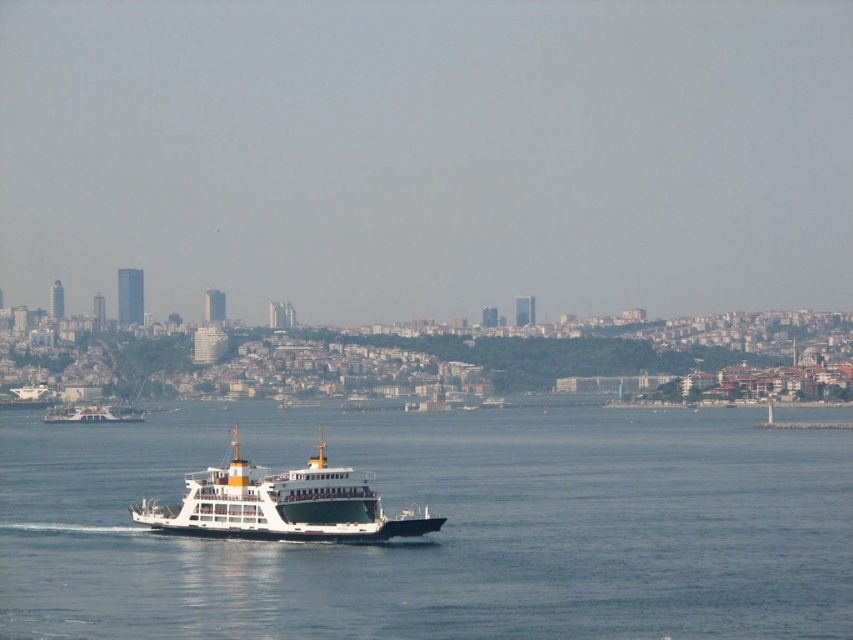
Question: Which point is farther to the camera?

Choices:
 (A) (463, 486)
 (B) (345, 490)

Answer: (A)

Question: Can you confirm if blue water at center is bigger than white matte ferry at center?

Choices:
 (A) no
 (B) yes

Answer: (B)

Question: Which point is farther from the camera taking this photo?

Choices:
 (A) (248, 525)
 (B) (44, 451)

Answer: (B)

Question: Where is blue water at center located in relation to white matte ferry at center in the image?

Choices:
 (A) above
 (B) below

Answer: (B)

Question: Considering the relative positions of blue water at center and white matte ferry at center in the image provided, where is blue water at center located with respect to white matte ferry at center?

Choices:
 (A) above
 (B) below

Answer: (B)